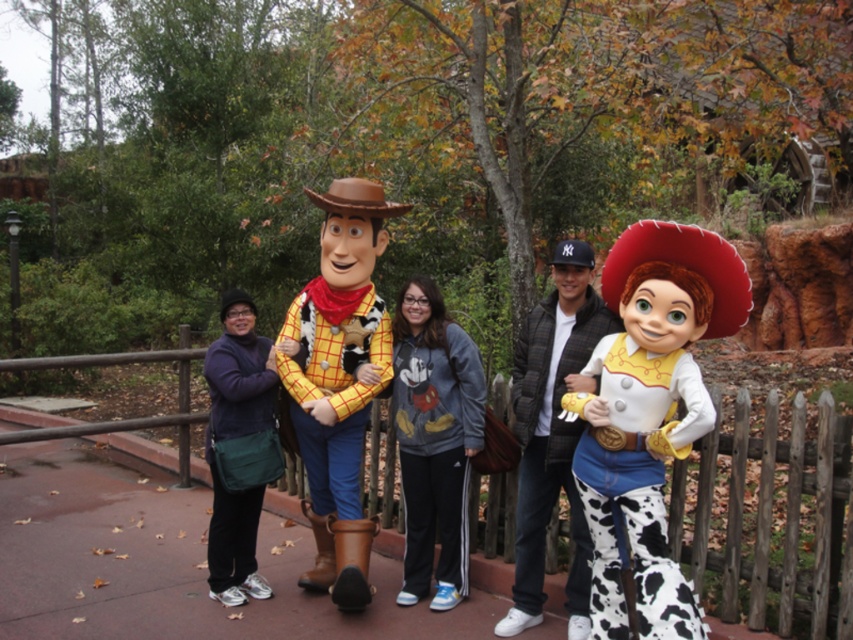
Question: Is matte yellow shirt at center to the left of cowprint fabric cowboy at center from the viewer's perspective?

Choices:
 (A) yes
 (B) no

Answer: (A)

Question: Which point is closer to the camera?

Choices:
 (A) (407, 547)
 (B) (514, 404)
 (C) (366, 240)

Answer: (B)

Question: From the image, what is the correct spatial relationship of matte yellow shirt at center in relation to cowprint fabric cowboy at center?

Choices:
 (A) above
 (B) below

Answer: (A)

Question: Which object is farther from the camera taking this photo?

Choices:
 (A) matte yellow shirt at center
 (B) cowprint fabric cowboy at center

Answer: (A)

Question: Which object is the farthest from the cowprint fabric cowboy at center?

Choices:
 (A) gray fleece sweatshirt at center
 (B) cow print fabric cowboy hat at right
 (C) matte yellow shirt at center

Answer: (C)

Question: Does matte yellow shirt at center have a smaller size compared to gray fleece sweatshirt at center?

Choices:
 (A) yes
 (B) no

Answer: (B)